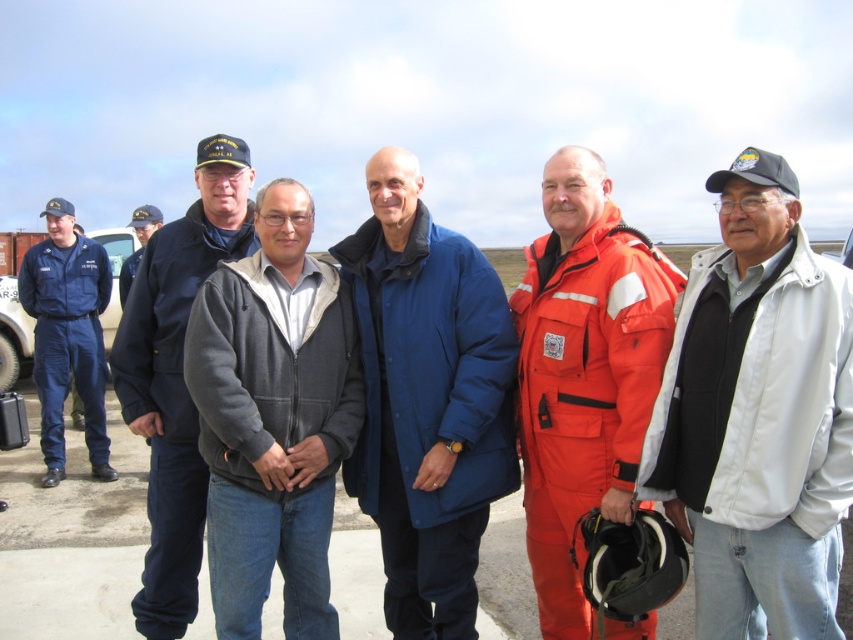
You are organizing a group photo and need to arrange the navy blue jacket at center and the matte blue jumpsuit at left so that both fit within a 2 meter wide frame. Given their widths, which one should be placed closer to the edges to ensure they both fit?

The navy blue jacket at center is narrower than the matte blue jumpsuit at left, so place the wider matte blue jumpsuit at left near the edge and the narrower navy blue jacket at center in the middle to fit within the 2 meter frame.

You are a photographer trying to capture a group photo of the white matte jacket at center and the navy blue jacket at center. Since you want to ensure both are in frame, which direction should you position yourself relative to the group?

You should position yourself to the left of the group so that both the white matte jacket at center and the navy blue jacket at center are visible in the frame, as the white matte jacket at center is to the right of the navy blue jacket at center.